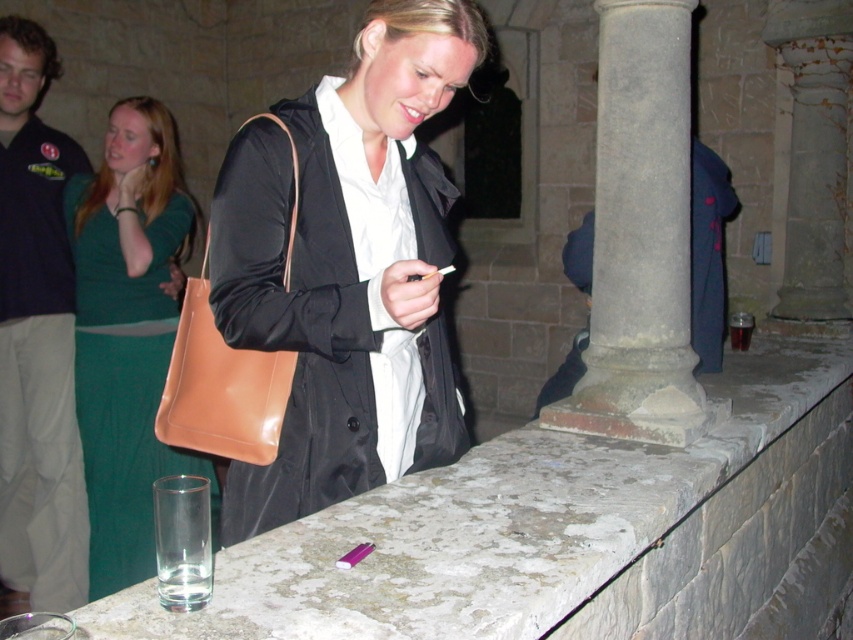
Question: Is matte black coat at center to the left of brown leather handbag at center from the viewer's perspective?

Choices:
 (A) no
 (B) yes

Answer: (A)

Question: Which object is positioned closest to the green satin dress at left?

Choices:
 (A) brown leather handbag at center
 (B) matte black coat at center

Answer: (A)

Question: Estimate the real-world distances between objects in this image. Which object is farther from the green satin dress at left?

Choices:
 (A) brown leather handbag at center
 (B) matte black coat at center

Answer: (B)

Question: Can you confirm if matte black coat at center is smaller than brown leather handbag at center?

Choices:
 (A) yes
 (B) no

Answer: (B)

Question: Which point is closer to the camera taking this photo?

Choices:
 (A) (294, 196)
 (B) (142, 148)
 (C) (373, 77)

Answer: (A)

Question: Does matte black coat at center have a larger size compared to green satin dress at left?

Choices:
 (A) no
 (B) yes

Answer: (A)